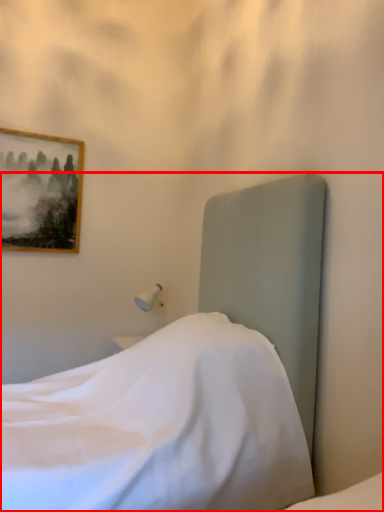
Question: From the image's perspective, where is bed (annotated by the red box) located relative to picture frame?

Choices:
 (A) above
 (B) below

Answer: (B)